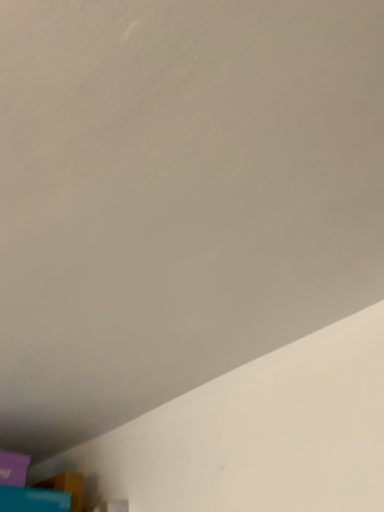
Question: Is purple matte box at lower left oriented towards blue cardboard box at lower left?

Choices:
 (A) no
 (B) yes

Answer: (A)

Question: Is there a large distance between purple matte box at lower left and blue cardboard box at lower left?

Choices:
 (A) no
 (B) yes

Answer: (A)

Question: Can we say purple matte box at lower left lies outside blue cardboard box at lower left?

Choices:
 (A) yes
 (B) no

Answer: (A)

Question: From a real-world perspective, is purple matte box at lower left located beneath blue cardboard box at lower left?

Choices:
 (A) yes
 (B) no

Answer: (B)

Question: Is purple matte box at lower left at the left side of blue cardboard box at lower left?

Choices:
 (A) no
 (B) yes

Answer: (B)

Question: Considering the relative sizes of purple matte box at lower left and blue cardboard box at lower left in the image provided, is purple matte box at lower left wider than blue cardboard box at lower left?

Choices:
 (A) no
 (B) yes

Answer: (A)

Question: From a real-world perspective, is blue cardboard box at lower left physically above purple matte box at lower left?

Choices:
 (A) yes
 (B) no

Answer: (B)

Question: Considering the relative sizes of blue cardboard box at lower left and purple matte box at lower left in the image provided, is blue cardboard box at lower left bigger than purple matte box at lower left?

Choices:
 (A) yes
 (B) no

Answer: (A)

Question: Considering the relative sizes of blue cardboard box at lower left and purple matte box at lower left in the image provided, is blue cardboard box at lower left shorter than purple matte box at lower left?

Choices:
 (A) no
 (B) yes

Answer: (B)

Question: Does blue cardboard box at lower left have a greater width compared to purple matte box at lower left?

Choices:
 (A) yes
 (B) no

Answer: (A)

Question: Is blue cardboard box at lower left surrounding purple matte box at lower left?

Choices:
 (A) no
 (B) yes

Answer: (A)

Question: Can you confirm if blue cardboard box at lower left is positioned to the right of purple matte box at lower left?

Choices:
 (A) no
 (B) yes

Answer: (B)

Question: Looking at the image, does blue cardboard box at lower left seem bigger or smaller compared to purple matte box at lower left?

Choices:
 (A) small
 (B) big

Answer: (B)